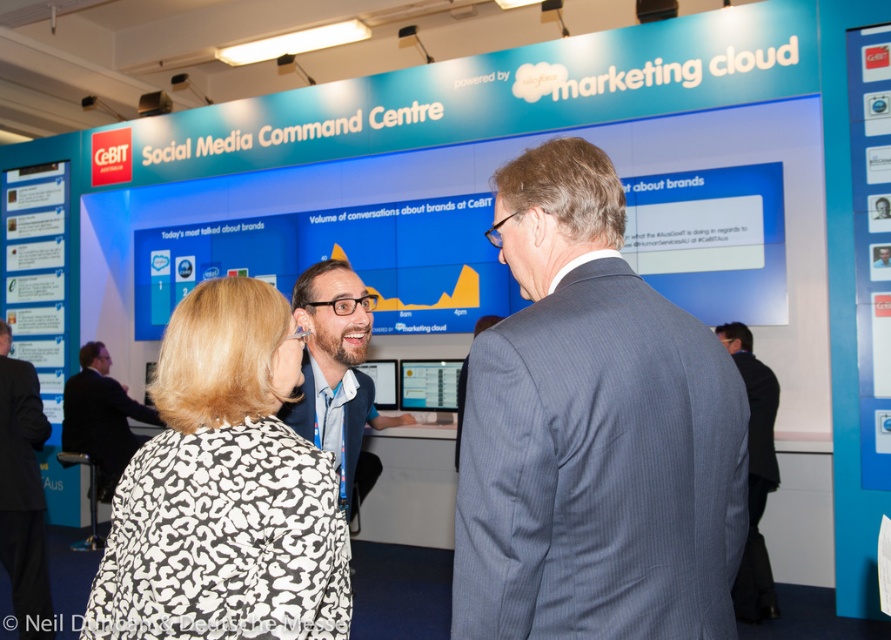
Question: Which of these objects is positioned farthest from the dark blue pinstripe suit at center?

Choices:
 (A) black leopard print jacket at center
 (B) dark suit at center
 (C) matte black suit at center

Answer: (B)

Question: Which of these objects is positioned closest to the dark suit at center?

Choices:
 (A) gray suit at center
 (B) blue fabric business suit at center
 (C) matte black suit at center
 (D) black leopard print jacket at center

Answer: (B)

Question: Where is matte black suit at center located in relation to dark blue suit at center in the image?

Choices:
 (A) right
 (B) left

Answer: (A)

Question: Can you confirm if dark blue pinstripe suit at center is positioned above black leopard print jacket at center?

Choices:
 (A) no
 (B) yes

Answer: (B)

Question: Is the position of dark blue suit at center more distant than that of blue fabric business suit at center?

Choices:
 (A) yes
 (B) no

Answer: (A)

Question: Among these points, which one is farthest from the camera?

Choices:
 (A) (119, 416)
 (B) (734, 570)
 (C) (751, 444)

Answer: (A)